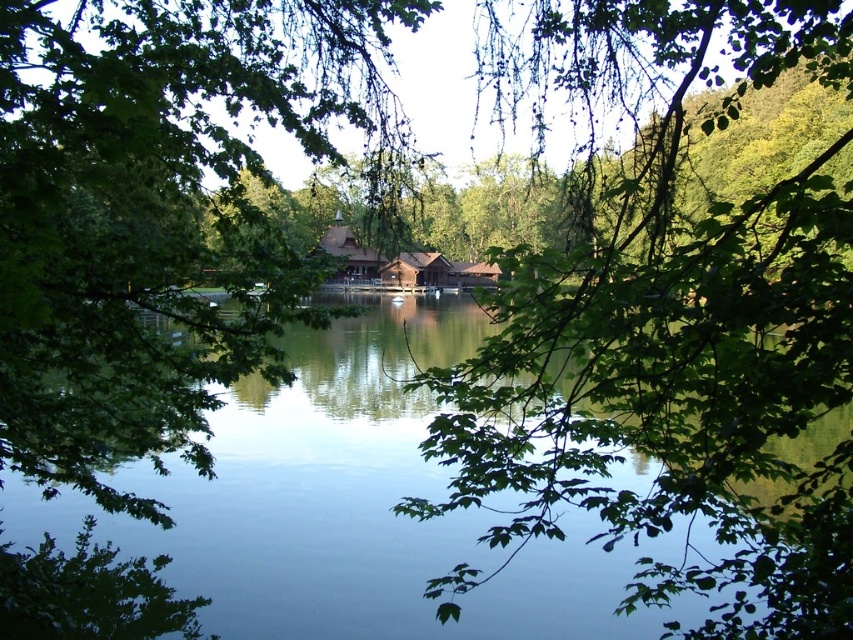
You are an artist sketching the lakeside scene. You notice the green leafy branch at center and the transparent water at center. Which object is closer to your viewpoint? Please explain based on their positions.

The green leafy branch at center is closer to your viewpoint because it is positioned below the transparent water at center, meaning it is in front of the water in the scene.

You are an artist trying to sketch this lakeside scene. You want to ensure the green leafy branch at center and the brown wooden cabin at center are positioned correctly in terms of depth. Which object should appear in front of the other in your drawing?

The green leafy branch at center should appear in front of the brown wooden cabin at center because it is closer to the viewer.